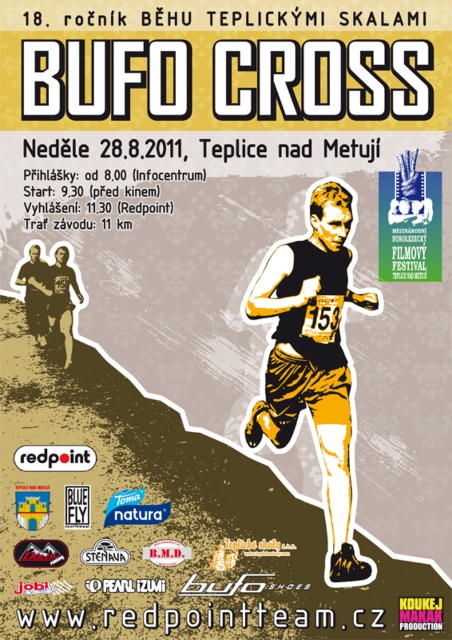
Question: Which object is the farthest from the yellow textured shorts at lower left?

Choices:
 (A) matte black running suit at lower left
 (B) yellow textured shorts at center

Answer: (B)

Question: Considering the real-world distances, which object is closest to the yellow textured shorts at lower left?

Choices:
 (A) matte black running suit at lower left
 (B) yellow textured shorts at center

Answer: (A)

Question: Can you confirm if yellow textured shorts at center is smaller than yellow textured shorts at lower left?

Choices:
 (A) yes
 (B) no

Answer: (B)

Question: Which object appears farthest from the camera in this image?

Choices:
 (A) matte black running suit at lower left
 (B) yellow textured shorts at center

Answer: (A)

Question: Where is yellow textured shorts at center located in relation to matte black running suit at lower left in the image?

Choices:
 (A) left
 (B) right

Answer: (B)

Question: Considering the relative positions of yellow textured shorts at center and matte black running suit at lower left in the image provided, where is yellow textured shorts at center located with respect to matte black running suit at lower left?

Choices:
 (A) right
 (B) left

Answer: (A)